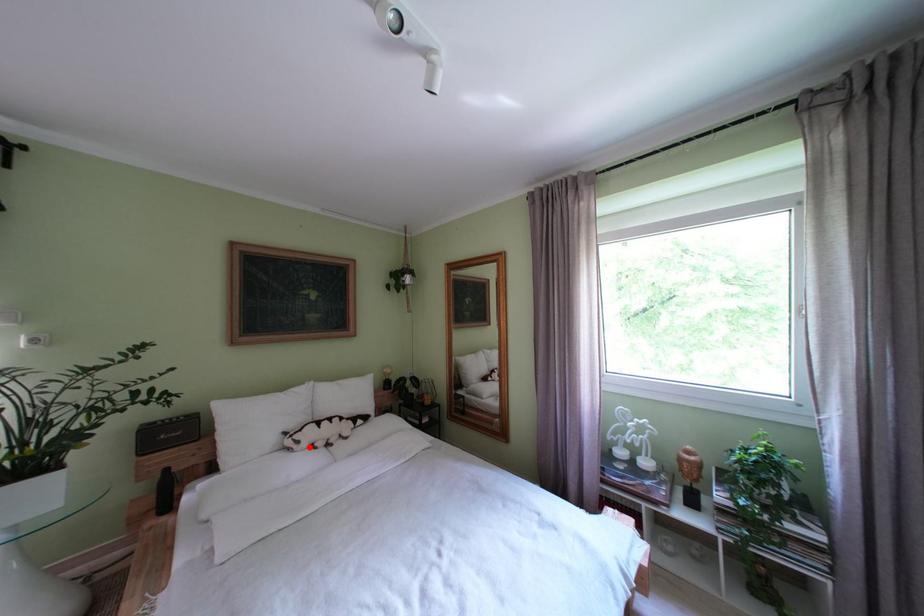
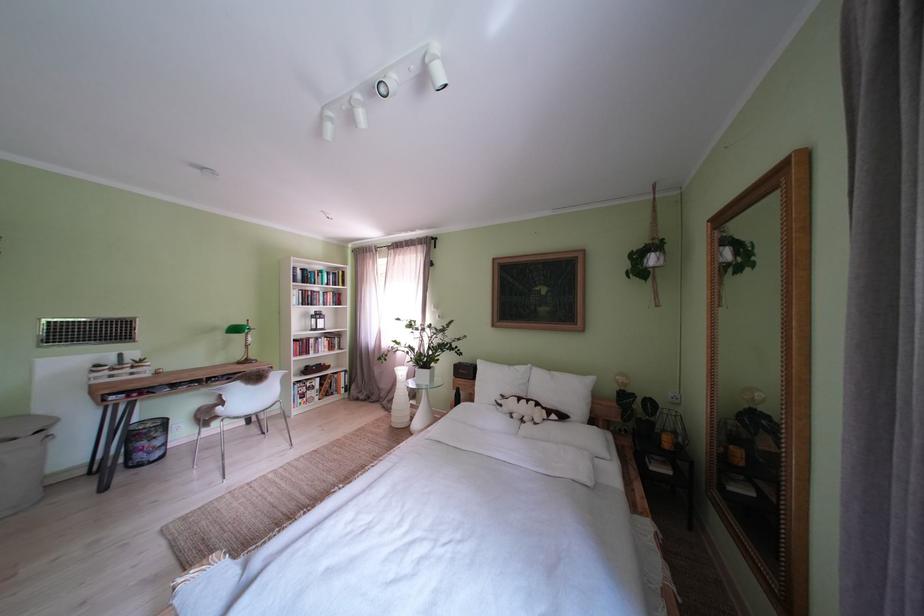
Where in the second image is the point corresponding to the highlighted location from the first image?

(512, 411)